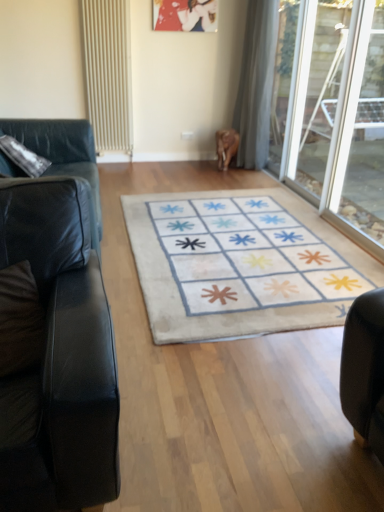
Where is `black leather couch at left, placed as the second studio couch when sorted from front to back`? The image size is (384, 512). black leather couch at left, placed as the second studio couch when sorted from front to back is located at coordinates point(64,156).

The height and width of the screenshot is (512, 384). What do you see at coordinates (256, 84) in the screenshot?
I see `white sheer curtain at upper center` at bounding box center [256, 84].

This screenshot has height=512, width=384. What do you see at coordinates (359, 134) in the screenshot?
I see `transparent glass door at right, the 2th glass door positioned from the back` at bounding box center [359, 134].

Locate an element on the screen. The height and width of the screenshot is (512, 384). transparent glass door at right, which is the 1th glass door in front-to-back order is located at coordinates (359, 134).

From the picture: What is the approximate width of metallic silver picture frame at upper center?

metallic silver picture frame at upper center is 1.97 inches in width.

This screenshot has width=384, height=512. Describe the element at coordinates (108, 73) in the screenshot. I see `beige textured radiator at upper left` at that location.

This screenshot has height=512, width=384. In order to click on black leather couch at left, placed as the second studio couch when sorted from front to back in this screenshot , I will do `click(64, 156)`.

Between brown suede pillow at left and white soft rug at center, which one has less height?

white soft rug at center is shorter.

From the image's perspective, is brown suede pillow at left located above or below white soft rug at center?

brown suede pillow at left is situated lower than white soft rug at center in the image.

Would you say brown suede pillow at left is to the left or to the right of white soft rug at center in the picture?

From the image, it's evident that brown suede pillow at left is to the left of white soft rug at center.

Is point (3, 330) positioned in front of point (338, 315)?

That is True.

From a real-world perspective, is metallic silver picture frame at upper center positioned under white sheer curtain at upper center based on gravity?

No.

Can you confirm if metallic silver picture frame at upper center is thinner than white sheer curtain at upper center?

Yes, metallic silver picture frame at upper center is thinner than white sheer curtain at upper center.

Are metallic silver picture frame at upper center and white sheer curtain at upper center beside each other?

No, metallic silver picture frame at upper center is not making contact with white sheer curtain at upper center.

Does metallic silver picture frame at upper center appear on the left side of white sheer curtain at upper center?

Correct, you'll find metallic silver picture frame at upper center to the left of white sheer curtain at upper center.

Considering the sizes of black leather couch at left, which appears as the 1th studio couch when viewed from the back, and transparent glass door at right, the 2th glass door positioned from the back, in the image, is black leather couch at left, which appears as the 1th studio couch when viewed from the back, wider or thinner than transparent glass door at right, the 2th glass door positioned from the back,?

In the image, black leather couch at left, which appears as the 1th studio couch when viewed from the back, appears to be wider than transparent glass door at right, the 2th glass door positioned from the back.

Is black leather couch at left, which appears as the 1th studio couch when viewed from the back, in front of or behind transparent glass door at right, which is the 1th glass door in front-to-back order, in the image?

Visually, black leather couch at left, which appears as the 1th studio couch when viewed from the back, is located in front of transparent glass door at right, which is the 1th glass door in front-to-back order.

Is transparent glass door at right, which is the 1th glass door in front-to-back order, surrounded by black leather couch at left, placed as the second studio couch when sorted from front to back?

Definitely not — transparent glass door at right, which is the 1th glass door in front-to-back order, is not inside black leather couch at left, placed as the second studio couch when sorted from front to back.

Is black leather couch at left, which appears as the 1th studio couch when viewed from the back, bigger or smaller than transparent glass door at right, the 2th glass door positioned from the back?

In the image, black leather couch at left, which appears as the 1th studio couch when viewed from the back, appears to be larger than transparent glass door at right, the 2th glass door positioned from the back.

What's the angular difference between white sheer curtain at upper center and transparent glass door at right, which is the 1th glass door in front-to-back order,'s facing directions?

white sheer curtain at upper center and transparent glass door at right, which is the 1th glass door in front-to-back order, are facing 4.31 degrees away from each other.

Which object is wider, white sheer curtain at upper center or transparent glass door at right, which is the 1th glass door in front-to-back order?

white sheer curtain at upper center is wider.

From a real-world perspective, is white sheer curtain at upper center over transparent glass door at right, the 2th glass door positioned from the back?

Indeed, from a real-world perspective, white sheer curtain at upper center stands above transparent glass door at right, the 2th glass door positioned from the back.

Is point (261, 128) closer to viewer compared to point (355, 94)?

No, (261, 128) is further to viewer.

Does transparent glass door at right, the 1th glass door from the back, turn towards beige textured radiator at upper left?

No, transparent glass door at right, the 1th glass door from the back, is not oriented towards beige textured radiator at upper left.

Which object is closer to the camera, transparent glass door at right, which is the 2th glass door in front-to-back order, or beige textured radiator at upper left?

Positioned in front is transparent glass door at right, which is the 2th glass door in front-to-back order.

Is point (324, 2) closer or farther from the camera than point (129, 93)?

Clearly, point (324, 2) is closer to the camera than point (129, 93).

Would you say transparent glass door at right, which is the 2th glass door in front-to-back order, is to the left or to the right of beige textured radiator at upper left in the picture?

From the image, it's evident that transparent glass door at right, which is the 2th glass door in front-to-back order, is to the right of beige textured radiator at upper left.

Between black leather couch at left, which appears as the 1th studio couch when viewed from the back, and white sheer curtain at upper center, which one has more height?

Standing taller between the two is white sheer curtain at upper center.

Which is behind, point (93, 229) or point (249, 109)?

Positioned behind is point (249, 109).

Is black leather couch at left, placed as the second studio couch when sorted from front to back, looking in the opposite direction of white sheer curtain at upper center?

That's not correct — black leather couch at left, placed as the second studio couch when sorted from front to back, is not looking away from white sheer curtain at upper center.

Could you measure the distance between black leather couch at left, which appears as the 1th studio couch when viewed from the back, and white sheer curtain at upper center?

black leather couch at left, which appears as the 1th studio couch when viewed from the back, and white sheer curtain at upper center are 7.50 feet apart from each other.

Is point (300, 160) positioned behind point (29, 341)?

Yes, point (300, 160) is farther from viewer.

Which of these two, transparent glass door at right, the 1th glass door from the back, or brown suede pillow at left, stands taller?

transparent glass door at right, the 1th glass door from the back, is taller.

Is transparent glass door at right, the 1th glass door from the back, far away from brown suede pillow at left?

transparent glass door at right, the 1th glass door from the back, is far away from brown suede pillow at left.

Can you tell me how much transparent glass door at right, which is the 2th glass door in front-to-back order, and brown suede pillow at left differ in facing direction?

97.6 degrees.

Identify the location of pillow located on the left of white soft rug at center. This screenshot has width=384, height=512. (20, 320).

Where is `curtain below the metallic silver picture frame at upper center (from a real-world perspective)`? The width and height of the screenshot is (384, 512). curtain below the metallic silver picture frame at upper center (from a real-world perspective) is located at coordinates (256, 84).

When comparing their distances from transparent glass door at right, the 2th glass door positioned from the back, does black leather couch at left, positioned as the first studio couch in front-to-back order, or transparent glass door at right, the 1th glass door from the back, seem closer?

transparent glass door at right, the 1th glass door from the back, lies closer to transparent glass door at right, the 2th glass door positioned from the back, than the other object.

Estimate the real-world distances between objects in this image. Which object is closer to black leather couch at left, which appears as the 1th studio couch when viewed from the back, transparent glass door at right, which is the 1th glass door in front-to-back order, or white sheer curtain at upper center?

Based on the image, white sheer curtain at upper center appears to be nearer to black leather couch at left, which appears as the 1th studio couch when viewed from the back.

Estimate the real-world distances between objects in this image. Which object is further from white soft rug at center, transparent glass door at right, the 1th glass door from the back, or brown suede pillow at left?

The object further to white soft rug at center is brown suede pillow at left.

Based on their spatial positions, is metallic silver picture frame at upper center or black leather couch at left, the 2th studio couch positioned from the back, closer to white sheer curtain at upper center?

The object closer to white sheer curtain at upper center is metallic silver picture frame at upper center.

Based on their spatial positions, is black leather couch at left, the 2th studio couch positioned from the back, or metallic silver picture frame at upper center further from transparent glass door at right, which is the 2th glass door in front-to-back order?

The object further to transparent glass door at right, which is the 2th glass door in front-to-back order, is black leather couch at left, the 2th studio couch positioned from the back.

Looking at the image, which one is located further to brown suede pillow at left, black leather couch at left, positioned as the first studio couch in front-to-back order, or beige textured radiator at upper left?

Based on the image, beige textured radiator at upper left appears to be further to brown suede pillow at left.

Estimate the real-world distances between objects in this image. Which object is closer to black leather couch at left, placed as the second studio couch when sorted from front to back, beige textured radiator at upper left or black leather couch at left, positioned as the first studio couch in front-to-back order?

beige textured radiator at upper left lies closer to black leather couch at left, placed as the second studio couch when sorted from front to back, than the other object.

Estimate the real-world distances between objects in this image. Which object is closer to brown suede pillow at left, beige textured radiator at upper left or transparent glass door at right, which is the 1th glass door in front-to-back order?

transparent glass door at right, which is the 1th glass door in front-to-back order, is closer to brown suede pillow at left.

Find the location of `glass door situated between beige textured radiator at upper left and transparent glass door at right, which is the 1th glass door in front-to-back order, from left to right`. glass door situated between beige textured radiator at upper left and transparent glass door at right, which is the 1th glass door in front-to-back order, from left to right is located at coordinates (332, 112).

The width and height of the screenshot is (384, 512). What are the coordinates of `mat between black leather couch at left, positioned as the first studio couch in front-to-back order, and transparent glass door at right, which is the 1th glass door in front-to-back order, from left to right` in the screenshot? It's located at (239, 265).

You are a GUI agent. You are given a task and a screenshot of the screen. Output one action in this format:
    pyautogui.click(x=<x>, y=<y>)
    Task: Click on the glass door positioned between transparent glass door at right, which is the 1th glass door in front-to-back order, and metallic silver picture frame at upper center from near to far
    Image resolution: width=384 pixels, height=512 pixels.
    Given the screenshot: What is the action you would take?
    pyautogui.click(x=332, y=112)

The image size is (384, 512). I want to click on curtain positioned between brown suede pillow at left and beige textured radiator at upper left from near to far, so click(x=256, y=84).